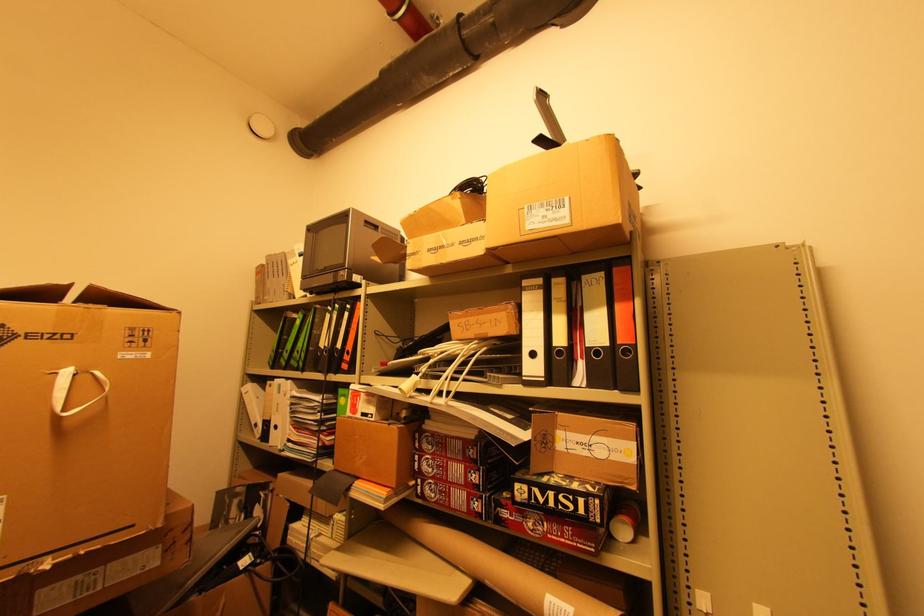
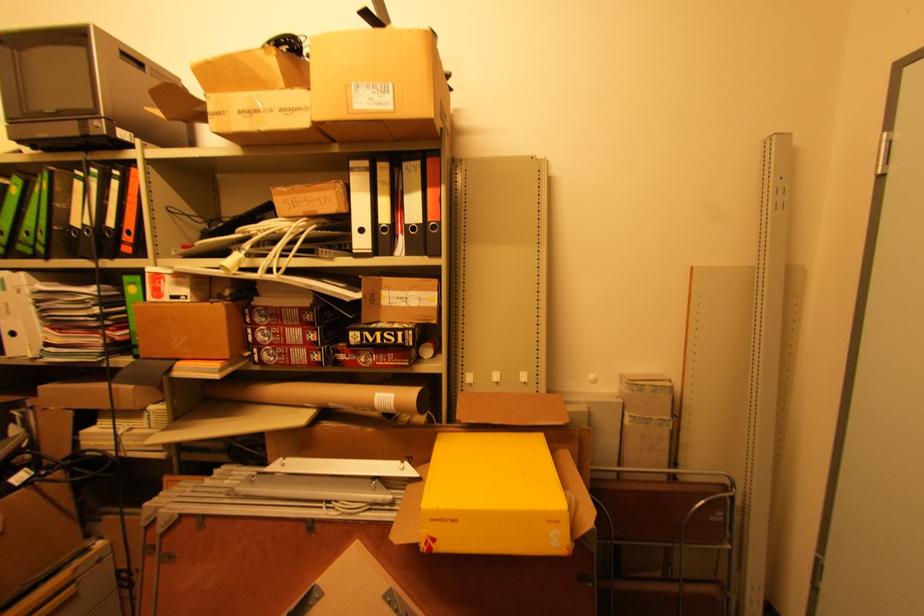
The point at (601,353) is marked in the first image. Where is the corresponding point in the second image?

(417, 229)